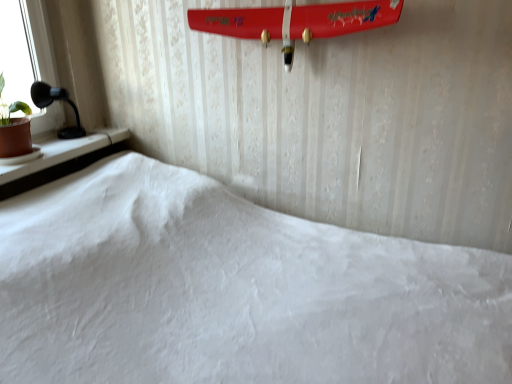
Question: Is black plastic table lamp at left far away from brown clay pot at left?

Choices:
 (A) yes
 (B) no

Answer: (B)

Question: Is black plastic table lamp at left shorter than brown clay pot at left?

Choices:
 (A) no
 (B) yes

Answer: (B)

Question: Considering the relative sizes of black plastic table lamp at left and brown clay pot at left in the image provided, is black plastic table lamp at left wider than brown clay pot at left?

Choices:
 (A) no
 (B) yes

Answer: (A)

Question: Is black plastic table lamp at left turned away from brown clay pot at left?

Choices:
 (A) yes
 (B) no

Answer: (B)

Question: Does black plastic table lamp at left appear on the left side of brown clay pot at left?

Choices:
 (A) yes
 (B) no

Answer: (B)

Question: Is black plastic table lamp at left directly adjacent to brown clay pot at left?

Choices:
 (A) no
 (B) yes

Answer: (A)

Question: Considering the relative positions of shiny red surfboard at upper center and brown clay pot at left in the image provided, is shiny red surfboard at upper center to the right of brown clay pot at left from the viewer's perspective?

Choices:
 (A) yes
 (B) no

Answer: (A)

Question: From a real-world perspective, does shiny red surfboard at upper center stand above brown clay pot at left?

Choices:
 (A) no
 (B) yes

Answer: (B)

Question: Are shiny red surfboard at upper center and brown clay pot at left far apart?

Choices:
 (A) yes
 (B) no

Answer: (B)

Question: Could brown clay pot at left be considered to be inside shiny red surfboard at upper center?

Choices:
 (A) yes
 (B) no

Answer: (B)

Question: Is shiny red surfboard at upper center smaller than brown clay pot at left?

Choices:
 (A) no
 (B) yes

Answer: (A)

Question: Can you confirm if shiny red surfboard at upper center is taller than brown clay pot at left?

Choices:
 (A) yes
 (B) no

Answer: (B)

Question: Is brown clay pot at left taller than black plastic table lamp at left?

Choices:
 (A) no
 (B) yes

Answer: (B)